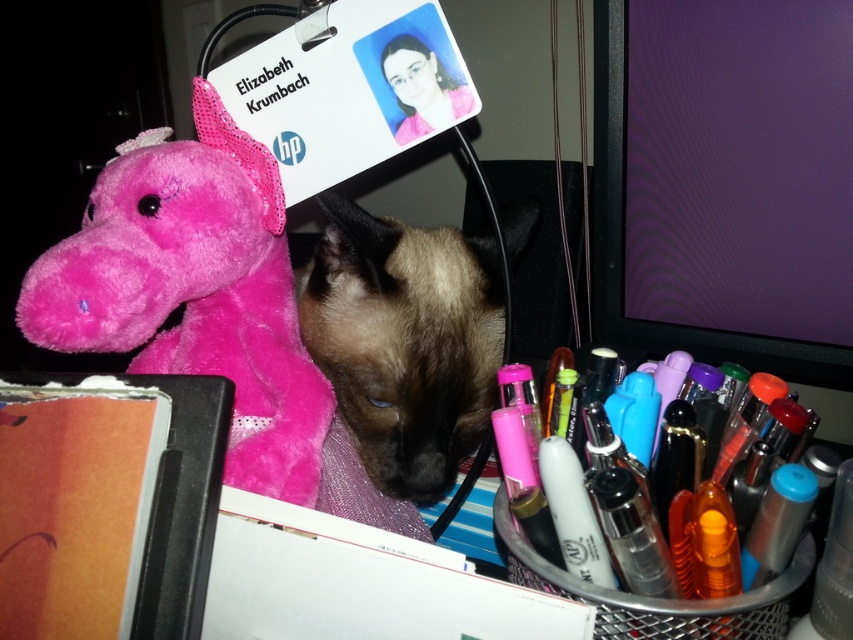
Question: Does purple glossy monitor at upper right have a lesser width compared to fuzzy pink stuffed animal at left?

Choices:
 (A) yes
 (B) no

Answer: (B)

Question: Which object is positioned closest to the fuzzy pink stuffed animal at left?

Choices:
 (A) brown fur cat at center
 (B) purple glossy monitor at upper right

Answer: (A)

Question: Which object is positioned farthest from the purple glossy monitor at upper right?

Choices:
 (A) brown fur cat at center
 (B) fuzzy pink stuffed animal at left

Answer: (B)

Question: Can you confirm if fuzzy pink stuffed animal at left is bigger than brown fur cat at center?

Choices:
 (A) no
 (B) yes

Answer: (A)

Question: Which point is closer to the camera taking this photo?

Choices:
 (A) 398,234
 (B) 299,346

Answer: (A)

Question: Is fuzzy pink stuffed animal at left below brown fur cat at center?

Choices:
 (A) no
 (B) yes

Answer: (A)